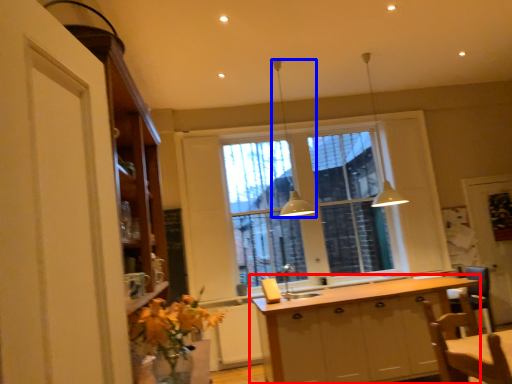
Question: Which point is closer to the camera, cabinetry (highlighted by a red box) or light fixture (highlighted by a blue box)?

Choices:
 (A) cabinetry
 (B) light fixture

Answer: (A)